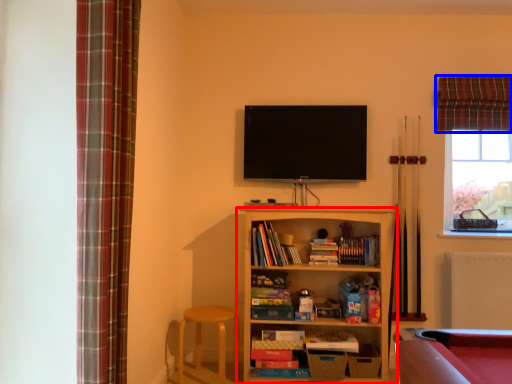
Question: Which object is closer to the camera taking this photo, shelf (highlighted by a red box) or curtain (highlighted by a blue box)?

Choices:
 (A) shelf
 (B) curtain

Answer: (A)